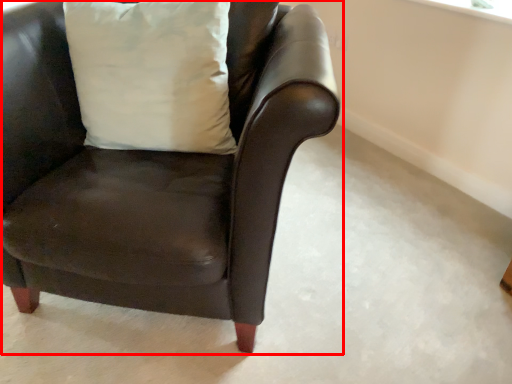
Question: From the image, what is the correct spatial relationship of chair (annotated by the red box) in relation to pillow?

Choices:
 (A) right
 (B) left

Answer: (A)